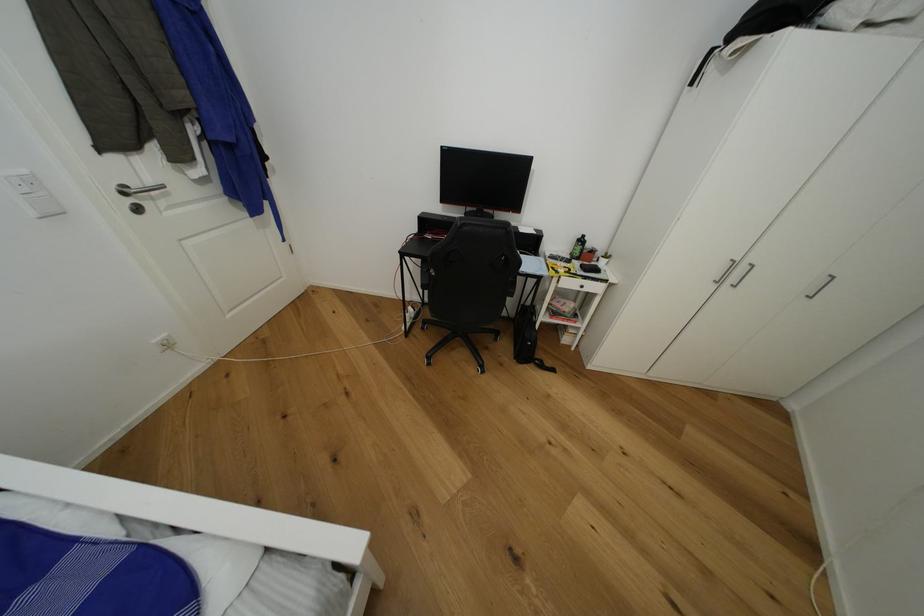
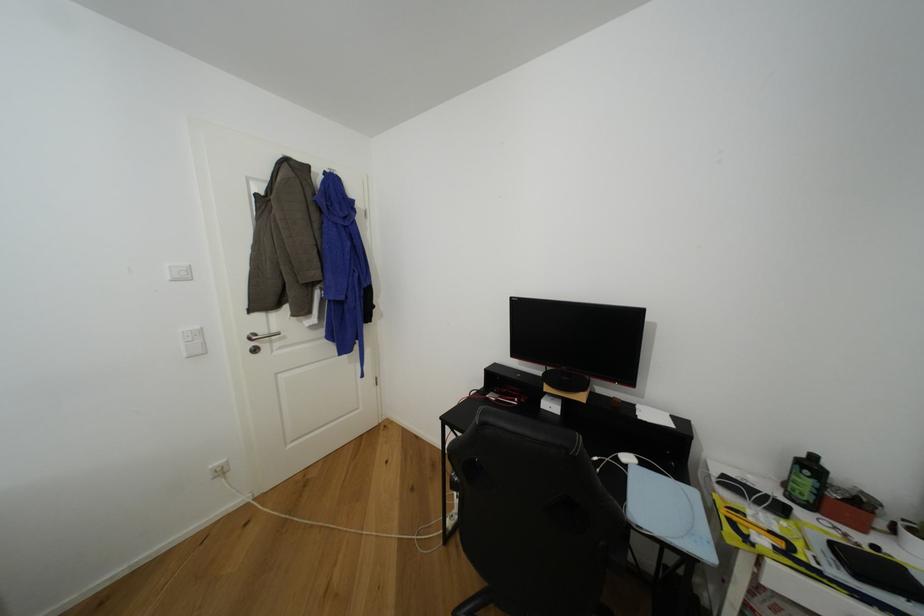
The point at (140, 185) is marked in the first image. Where is the corresponding point in the second image?

(268, 334)